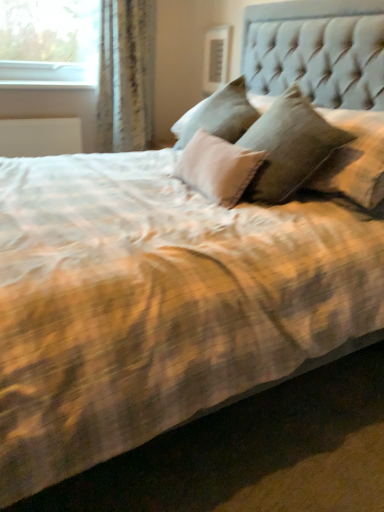
The width and height of the screenshot is (384, 512). Find the location of `white textured curtain at upper left`. white textured curtain at upper left is located at coordinates (126, 75).

The image size is (384, 512). Describe the element at coordinates (126, 75) in the screenshot. I see `white textured curtain at upper left` at that location.

In order to face white plastic window sill at upper left, should I rotate leftwards or rightwards?

Rotate your view left by about 18.305°.

Where is `white plastic window sill at upper left`? Image resolution: width=384 pixels, height=512 pixels. white plastic window sill at upper left is located at coordinates (46, 84).

Describe the element at coordinates (46, 84) in the screenshot. I see `white plastic window sill at upper left` at that location.

Locate an element on the screen. white textured curtain at upper left is located at coordinates (126, 75).

Based on the photo, does white textured curtain at upper left appear on the left side of white plastic window sill at upper left?

No.

Considering the positions of objects white textured curtain at upper left and white plastic window sill at upper left in the image provided, who is behind, white textured curtain at upper left or white plastic window sill at upper left?

white plastic window sill at upper left is further away from the camera.

Which is nearer, (100, 125) or (73, 82)?

Point (100, 125) appears to be farther away from the viewer than point (73, 82).

From the image's perspective, is white textured curtain at upper left beneath white plastic window sill at upper left?

Indeed, from the image's perspective, white textured curtain at upper left is shown beneath white plastic window sill at upper left.

From a real-world perspective, which object rests below the other?

white textured curtain at upper left, from a real-world perspective.

In terms of width, does white textured curtain at upper left look wider or thinner when compared to white plastic window sill at upper left?

Clearly, white textured curtain at upper left has more width compared to white plastic window sill at upper left.

Considering the sizes of objects white textured curtain at upper left and white plastic window sill at upper left in the image provided, who is taller, white textured curtain at upper left or white plastic window sill at upper left?

With more height is white textured curtain at upper left.

Based on their sizes in the image, would you say white textured curtain at upper left is bigger or smaller than white plastic window sill at upper left?

Clearly, white textured curtain at upper left is larger in size than white plastic window sill at upper left.

Looking at this image, is white textured curtain at upper left not inside white plastic window sill at upper left?

Yes, white textured curtain at upper left is outside of white plastic window sill at upper left.

Are white textured curtain at upper left and white plastic window sill at upper left far apart?

white textured curtain at upper left is actually quite close to white plastic window sill at upper left.

Does white textured curtain at upper left turn towards white plastic window sill at upper left?

No, white textured curtain at upper left is not facing towards white plastic window sill at upper left.

Find the location of a particular element. The height and width of the screenshot is (512, 384). curtain located below the white plastic window sill at upper left (from the image's perspective) is located at coordinates (126, 75).

Which object is positioned more to the left, white plastic window sill at upper left or white textured curtain at upper left?

Positioned to the left is white plastic window sill at upper left.

Is white plastic window sill at upper left closer to the viewer compared to white textured curtain at upper left?

No.

Is point (49, 87) positioned after point (101, 39)?

Yes.

From the image's perspective, which is below, white plastic window sill at upper left or white textured curtain at upper left?

white textured curtain at upper left is shown below in the image.

From a real-world perspective, between white plastic window sill at upper left and white textured curtain at upper left, who is vertically lower?

white textured curtain at upper left is physically lower.

Considering the sizes of objects white plastic window sill at upper left and white textured curtain at upper left in the image provided, who is thinner, white plastic window sill at upper left or white textured curtain at upper left?

white plastic window sill at upper left.

From the picture: From their relative heights in the image, would you say white plastic window sill at upper left is taller or shorter than white textured curtain at upper left?

In the image, white plastic window sill at upper left appears to be shorter than white textured curtain at upper left.

Based on their sizes in the image, would you say white plastic window sill at upper left is bigger or smaller than white textured curtain at upper left?

white plastic window sill at upper left is smaller than white textured curtain at upper left.

Is white plastic window sill at upper left outside of white textured curtain at upper left?

Yes, white plastic window sill at upper left is not within white textured curtain at upper left.

Is there a large distance between white plastic window sill at upper left and white textured curtain at upper left?

white plastic window sill at upper left is near white textured curtain at upper left, not far away.

Could you tell me if white plastic window sill at upper left is turned towards white textured curtain at upper left?

No, white plastic window sill at upper left is not aimed at white textured curtain at upper left.

Can you tell me how much white plastic window sill at upper left and white textured curtain at upper left differ in facing direction?

0.0173 degrees.

Where is `window sill above the white textured curtain at upper left (from a real-world perspective)`? window sill above the white textured curtain at upper left (from a real-world perspective) is located at coordinates (46, 84).

You are a GUI agent. You are given a task and a screenshot of the screen. Output one action in this format:
    pyautogui.click(x=<x>, y=<y>)
    Task: Click on the curtain in front of the white plastic window sill at upper left
    This screenshot has width=384, height=512.
    Given the screenshot: What is the action you would take?
    126,75

Where is `curtain that is under the white plastic window sill at upper left (from a real-world perspective)`? Image resolution: width=384 pixels, height=512 pixels. curtain that is under the white plastic window sill at upper left (from a real-world perspective) is located at coordinates (126, 75).